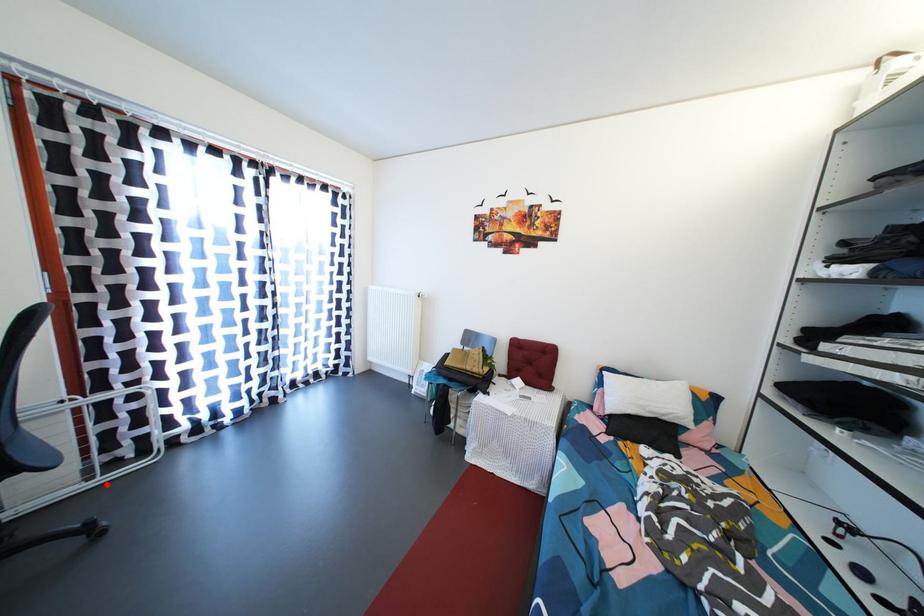
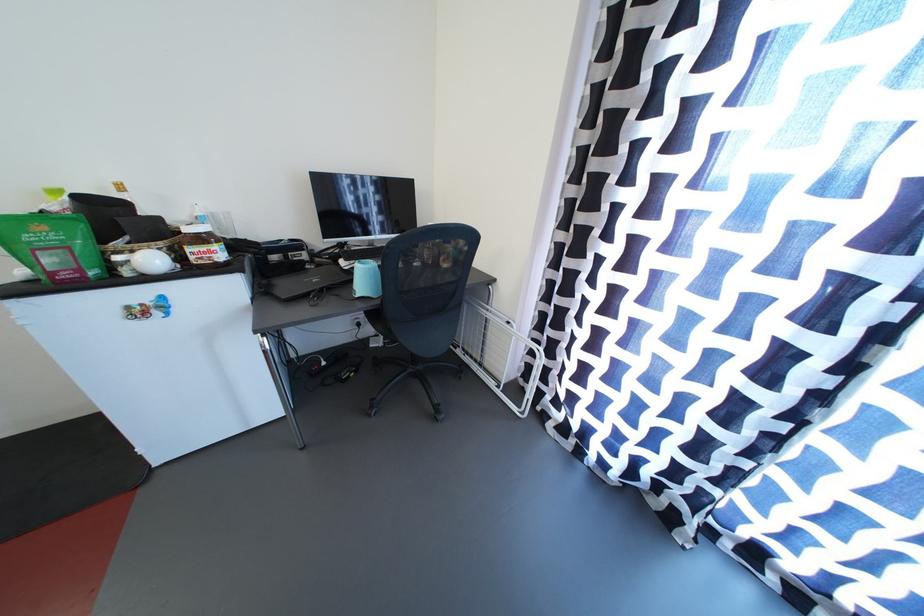
Find the pixel in the second image that matches the highlighted location in the first image.

(505, 397)